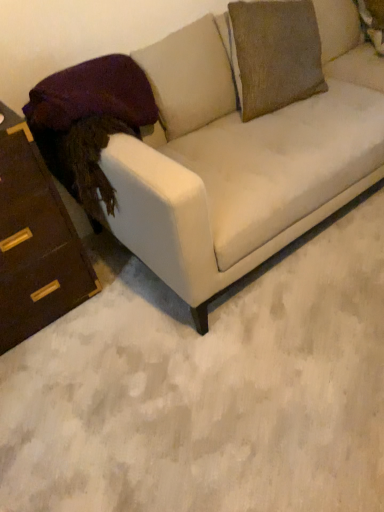
Question: Is matte white couch at center next to velvet purple pillow at left?

Choices:
 (A) yes
 (B) no

Answer: (B)

Question: Does matte white couch at center turn towards velvet purple pillow at left?

Choices:
 (A) yes
 (B) no

Answer: (B)

Question: Is matte white couch at center in front of velvet purple pillow at left?

Choices:
 (A) no
 (B) yes

Answer: (B)

Question: Is matte white couch at center further to camera compared to velvet purple pillow at left?

Choices:
 (A) no
 (B) yes

Answer: (A)

Question: Would you consider matte white couch at center to be distant from velvet purple pillow at left?

Choices:
 (A) no
 (B) yes

Answer: (A)

Question: Is matte white couch at center wider than velvet purple pillow at left?

Choices:
 (A) no
 (B) yes

Answer: (B)

Question: Is brown wood chest of drawers at left shorter than velvet purple pillow at left?

Choices:
 (A) yes
 (B) no

Answer: (B)

Question: From the image's perspective, is brown wood chest of drawers at left on top of velvet purple pillow at left?

Choices:
 (A) no
 (B) yes

Answer: (A)

Question: Can you confirm if brown wood chest of drawers at left is smaller than velvet purple pillow at left?

Choices:
 (A) yes
 (B) no

Answer: (B)

Question: Can you confirm if brown wood chest of drawers at left is positioned to the left of velvet purple pillow at left?

Choices:
 (A) no
 (B) yes

Answer: (B)

Question: Could you tell me if brown wood chest of drawers at left is turned towards velvet purple pillow at left?

Choices:
 (A) no
 (B) yes

Answer: (A)

Question: Are brown wood chest of drawers at left and velvet purple pillow at left beside each other?

Choices:
 (A) no
 (B) yes

Answer: (A)

Question: Does velvet purple pillow at left have a greater height compared to matte white couch at center?

Choices:
 (A) yes
 (B) no

Answer: (B)